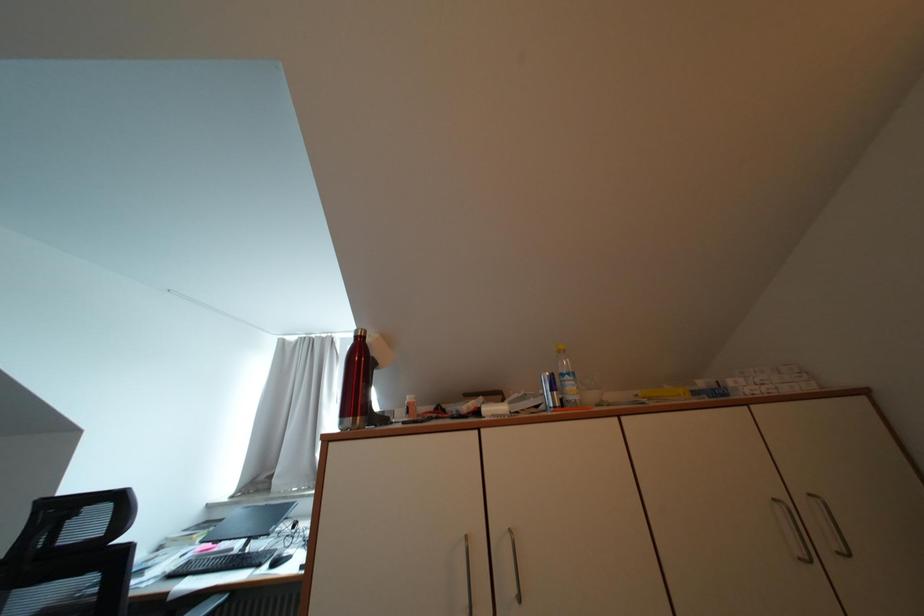
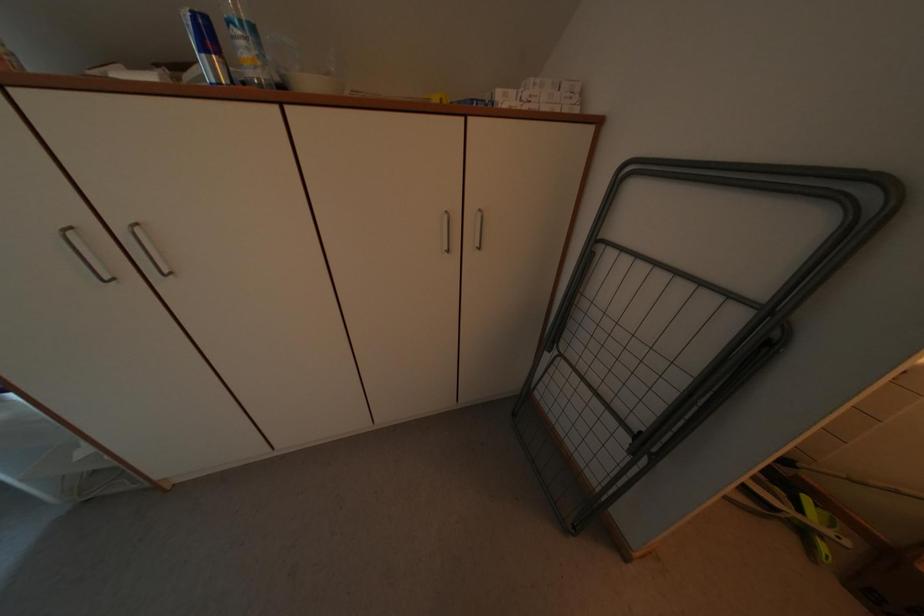
Based on the continuous images, in which direction is the camera rotating?

The camera rotated toward right-down.